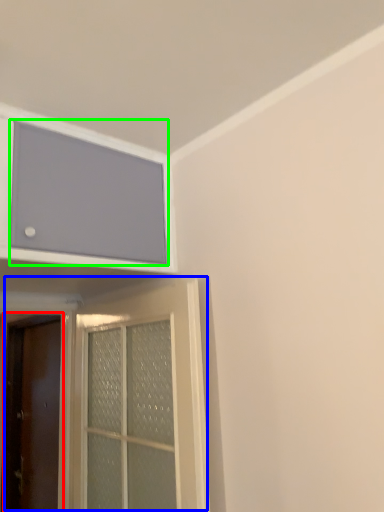
Question: Based on their relative distances, which object is farther from door (highlighted by a red box)? Choose from door (highlighted by a blue box) and window screen (highlighted by a green box).

Choices:
 (A) door
 (B) window screen

Answer: (B)